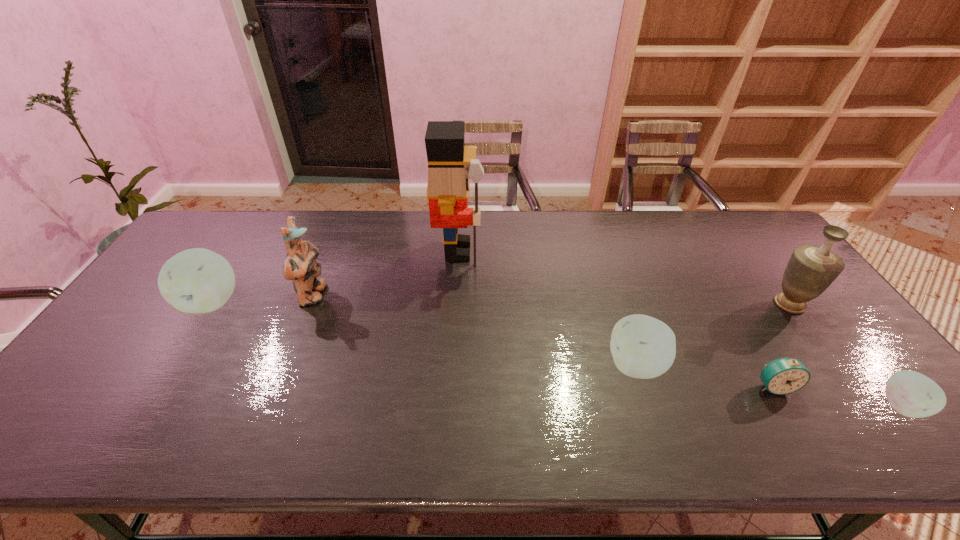
Find the location of a particular element. urn that is at the right edge is located at coordinates (811, 269).

At what (x,y) coordinates should I click in order to perform the action: click on object located in the near right corner section of the desktop. Please return your answer as a coordinate pair (x, y). The height and width of the screenshot is (540, 960). Looking at the image, I should click on (912, 394).

You are a GUI agent. You are given a task and a screenshot of the screen. Output one action in this format:
    pyautogui.click(x=<x>, y=<y>)
    Task: Click on the vacant region at the far edge of the desktop
    The width and height of the screenshot is (960, 540).
    Given the screenshot: What is the action you would take?
    click(x=658, y=217)

In the image, there is a desktop. Where is `vacant space at the near edge`? vacant space at the near edge is located at coordinates (564, 388).

This screenshot has height=540, width=960. In the image, there is a desktop. In order to click on vacant region at the left edge in this screenshot , I will do `click(147, 335)`.

The image size is (960, 540). What are the coordinates of `vacant space at the right edge of the desktop` in the screenshot? It's located at (843, 376).

This screenshot has height=540, width=960. I want to click on free space at the near left corner of the desktop, so pos(120,394).

In the image, there is a desktop. Identify the location of vacant region at the far right corner. The image size is (960, 540). (725, 214).

Locate an element on the screen. The width and height of the screenshot is (960, 540). free space between the fifth tallest object and the leftmost object is located at coordinates (424, 334).

This screenshot has width=960, height=540. I want to click on unoccupied position between the figurine and the fourth object from left to right, so click(x=474, y=330).